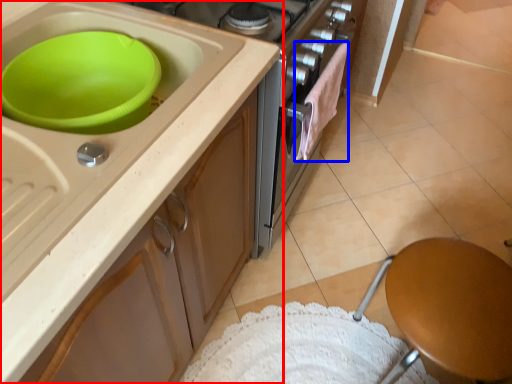
Question: Which of the following is the farthest to the observer, cabinetry (highlighted by a red box) or clothe (highlighted by a blue box)?

Choices:
 (A) cabinetry
 (B) clothe

Answer: (B)